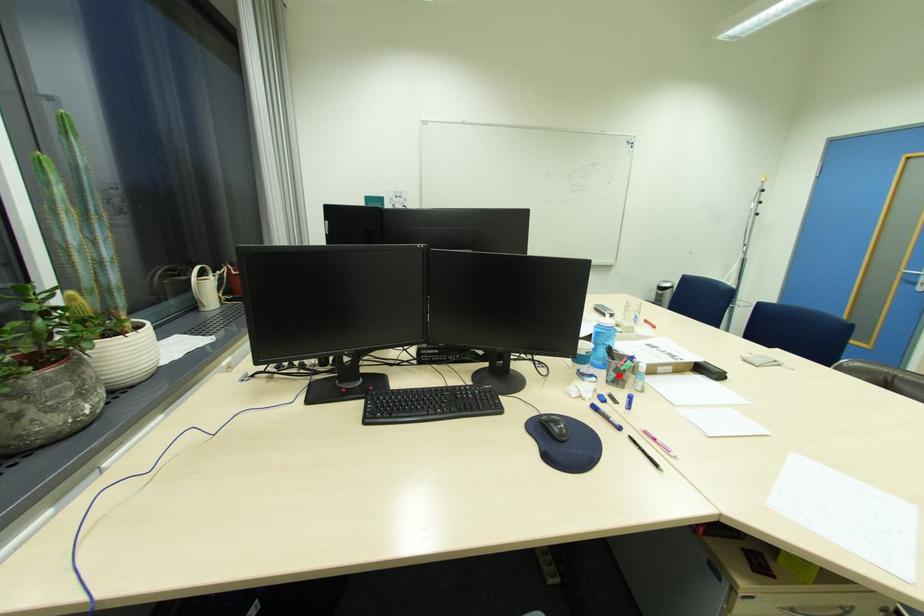
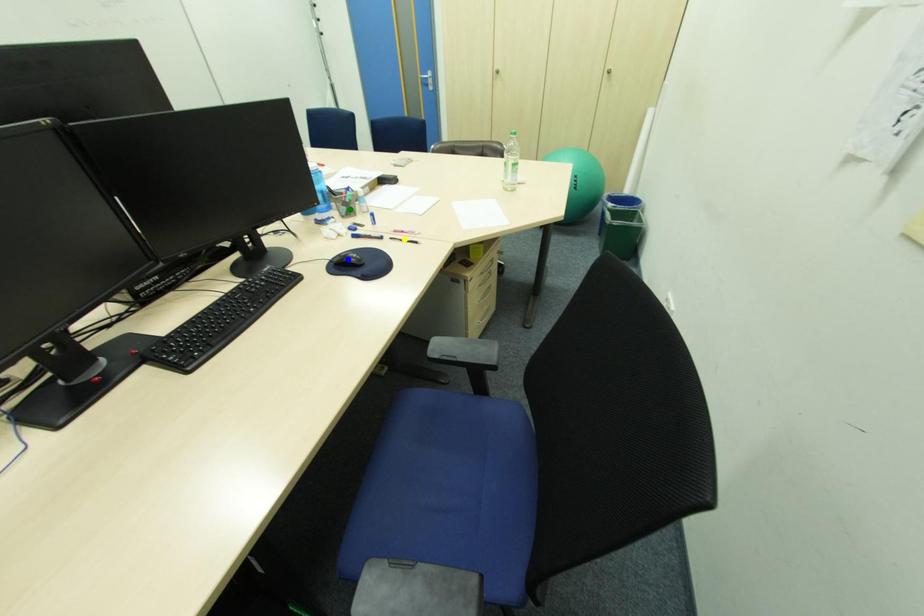
Question: I am providing you with two images of the same scene from different viewpoints. A red point is marked on the first image. You are given multiple points on the second image. Which spot in image 2 lines up with the point in image 1?

Choices:
 (A) green point
 (B) yellow point
 (C) blue point

Answer: (A)